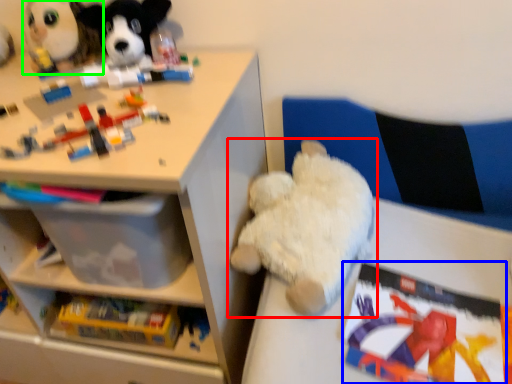
Question: Which is farther away from toy (highlighted by a red box)? book (highlighted by a blue box) or toy (highlighted by a green box)?

Choices:
 (A) book
 (B) toy

Answer: (B)